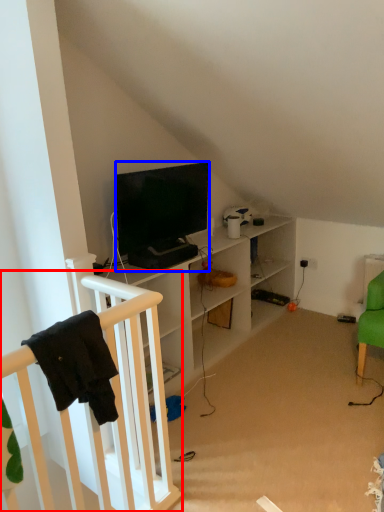
Question: Which object appears closest to the camera in this image, infant bed (highlighted by a red box) or television (highlighted by a blue box)?

Choices:
 (A) infant bed
 (B) television

Answer: (A)